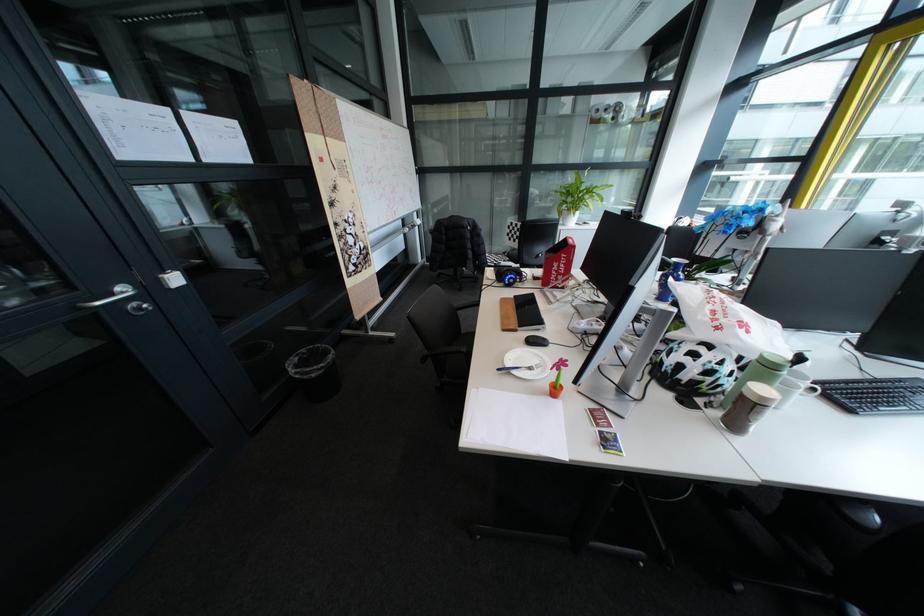
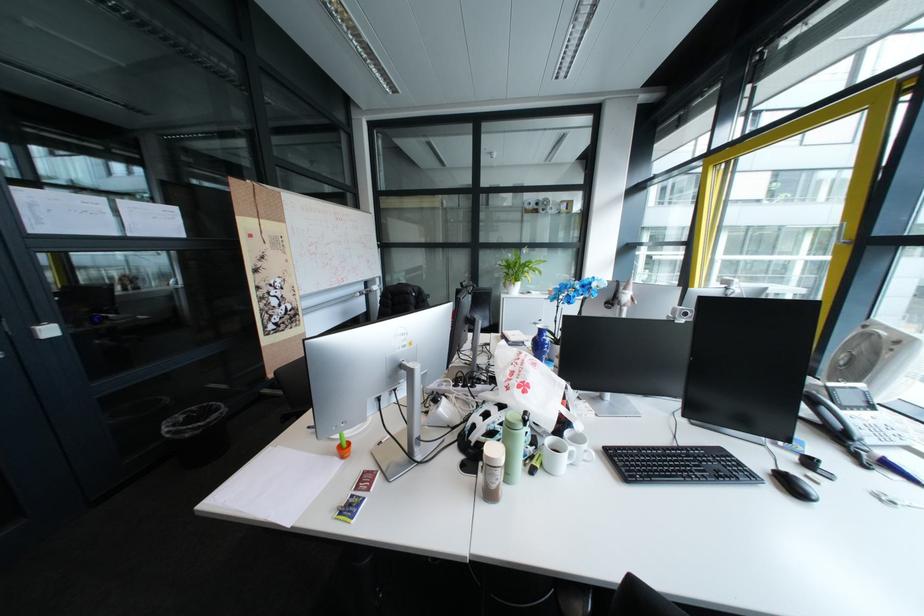
Locate, in the second image, the point that corresponds to [317,351] in the first image.

(208, 408)